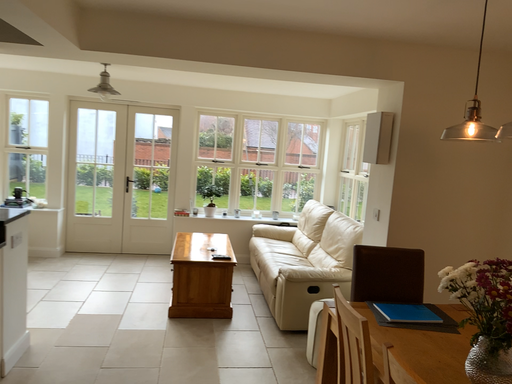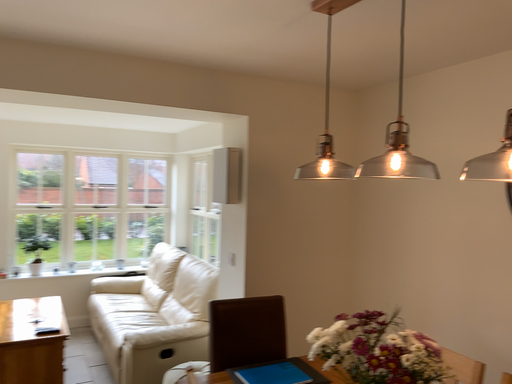
Question: Which way did the camera rotate in the video?

Choices:
 (A) rotated left
 (B) rotated right

Answer: (B)